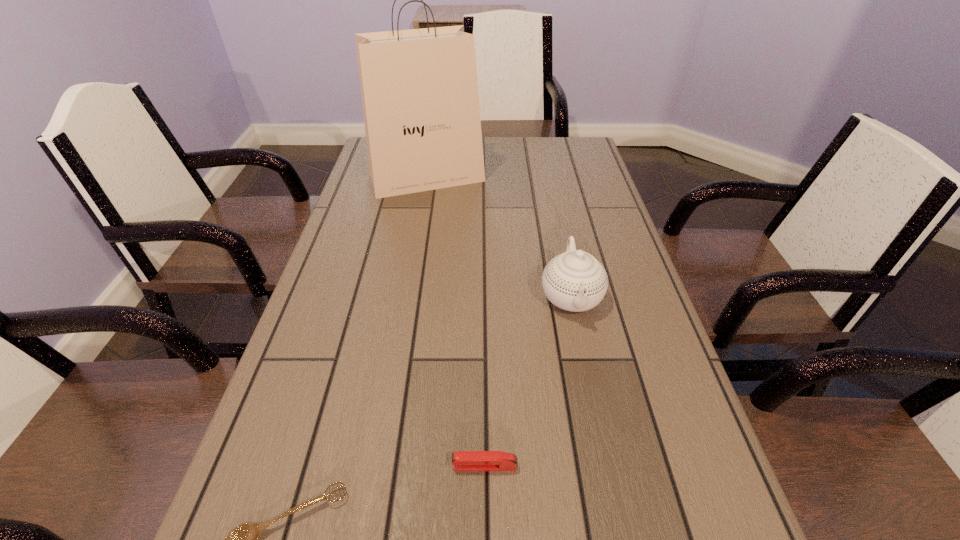
Where is `free space located 0.090m on the front-facing side of the second nearest object`? free space located 0.090m on the front-facing side of the second nearest object is located at coordinates (397, 466).

Locate an element on the screen. The image size is (960, 540). object that is at the far edge is located at coordinates (419, 88).

The image size is (960, 540). Find the location of `object that is at the left edge`. object that is at the left edge is located at coordinates (419, 88).

Identify the location of object present at the right edge. Image resolution: width=960 pixels, height=540 pixels. point(575,281).

At what (x,y) coordinates should I click in order to perform the action: click on object located in the far left corner section of the desktop. Please return your answer as a coordinate pair (x, y). The image size is (960, 540). Looking at the image, I should click on (419, 88).

Image resolution: width=960 pixels, height=540 pixels. Find the location of `vacant space at the far edge`. vacant space at the far edge is located at coordinates (517, 148).

Find the location of a particular element. This screenshot has height=540, width=960. blank space at the left edge is located at coordinates (326, 356).

Identify the location of blank space at the right edge of the desktop. (597, 245).

In order to click on vacant region at the far right corner of the desktop in this screenshot , I will do `click(592, 159)`.

You are a GUI agent. You are given a task and a screenshot of the screen. Output one action in this format:
    pyautogui.click(x=<x>, y=<y>)
    Task: Click on the free spot between the second tallest object and the stapler
    The height and width of the screenshot is (540, 960).
    Given the screenshot: What is the action you would take?
    pyautogui.click(x=528, y=381)